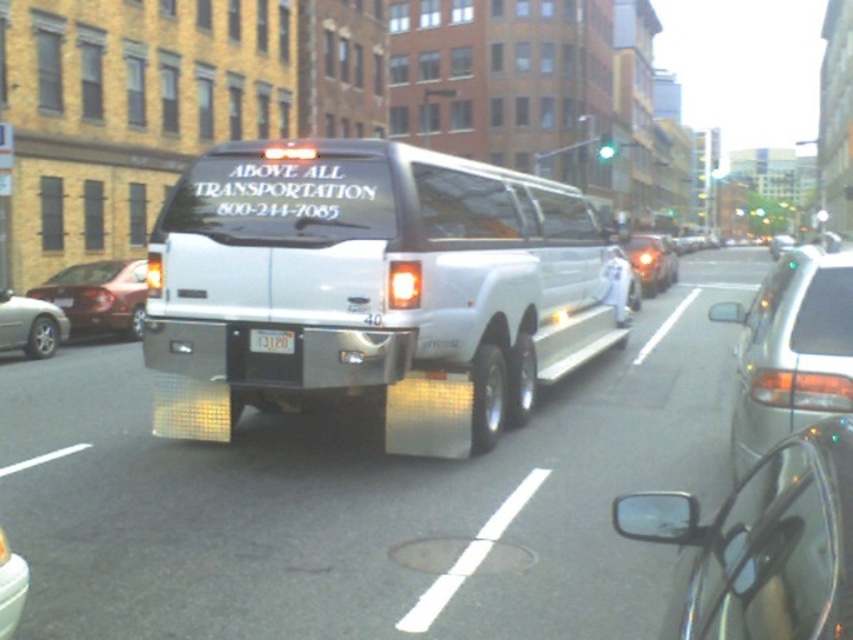
Can you confirm if metallic silver sedan at right is taller than black plastic license plate at center?

Correct, metallic silver sedan at right is much taller as black plastic license plate at center.

Who is positioned more to the right, metallic silver sedan at right or black plastic license plate at center?

From the viewer's perspective, metallic silver sedan at right appears more on the right side.

Between point (770, 291) and point (277, 340), which one is positioned in front?

Point (770, 291) is more forward.

I want to click on metallic silver sedan at right, so click(790, 349).

Which is in front, point (447, 304) or point (22, 576)?

Point (22, 576)

Is white glossy limousine at center shorter than metallic silver car at lower left?

Incorrect, white glossy limousine at center's height does not fall short of metallic silver car at lower left's.

Does point (369, 316) come closer to viewer compared to point (4, 588)?

No, it is behind (4, 588).

This screenshot has height=640, width=853. Identify the location of white glossy limousine at center. (374, 289).

Can you confirm if shiny chrome car at center is wider than metallic silver car at lower left?

Yes, shiny chrome car at center is wider than metallic silver car at lower left.

Image resolution: width=853 pixels, height=640 pixels. Find the location of `shiny chrome car at center`. shiny chrome car at center is located at coordinates (651, 260).

Describe the element at coordinates (651, 260) in the screenshot. I see `shiny chrome car at center` at that location.

Where is `shiny chrome car at center`? The width and height of the screenshot is (853, 640). shiny chrome car at center is located at coordinates (651, 260).